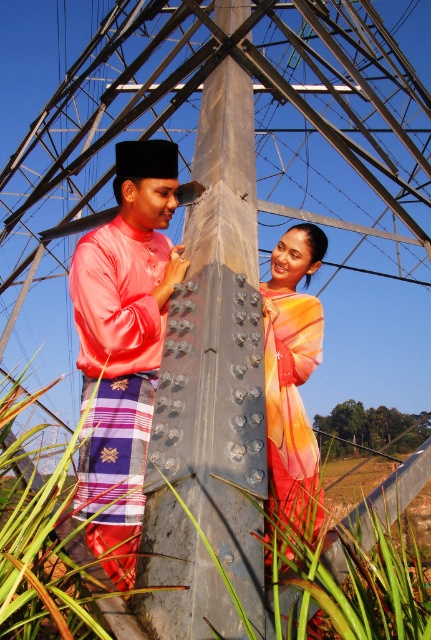
You are a photographer trying to capture the silky pink shirt at center. The camera is positioned at the point with coordinates point (x=124, y=346). To ensure the shirt is in focus, you need to know the distance between the camera and the silky pink shirt at center. Can you determine if the camera is close enough?

The camera is positioned exactly at the point where the silky pink shirt at center is located, so the distance is zero. Therefore, the camera is already in direct contact with the shirt, making it impossible to focus properly. Adjust the camera position slightly to ensure proper focus.

You are a photographer trying to capture a clear photo of the multicolored silk dress at center. However, the metallic gray pole at center is blocking your view. Can you move the pole to the side to get a better shot?

The metallic gray pole at center is positioned over multicolored silk dress at center, so moving the pole might be necessary to get an unobstructed view of the dress. However, since the pole is large and secured with bolts, it might be difficult to move without proper tools or permission.